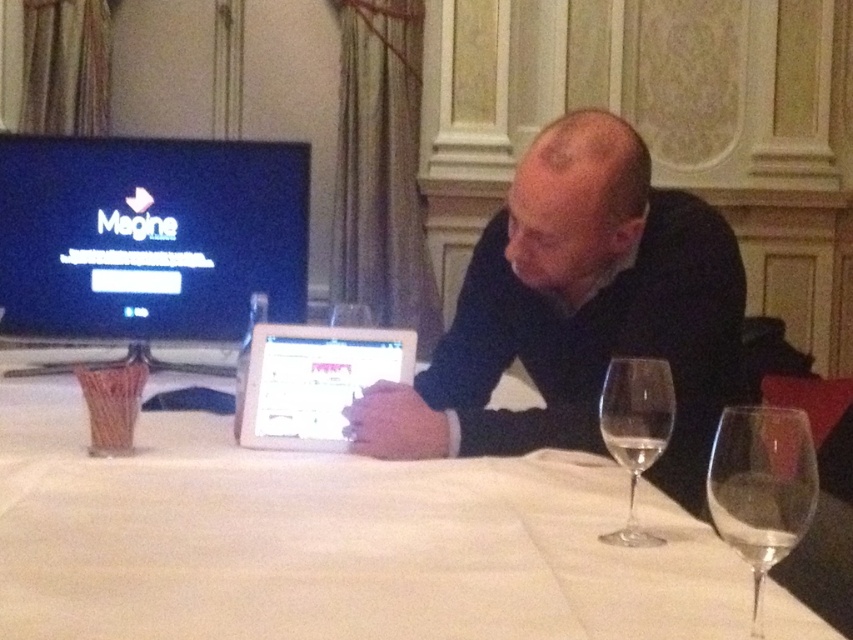
Can you confirm if white cloth at center is wider than silver metallic tablet at center?

Yes.

From the picture: Between white cloth at center and silver metallic tablet at center, which one has less height?

With less height is white cloth at center.

This screenshot has height=640, width=853. In order to click on white cloth at center in this screenshot , I will do `click(331, 540)`.

Does dark blue shirt at center have a greater height compared to clear glass at lower center?

Yes, dark blue shirt at center is taller than clear glass at lower center.

Which is behind, point (717, 419) or point (646, 435)?

The point (717, 419) is more distant.

At what (x,y) coordinates should I click in order to perform the action: click on dark blue shirt at center. Please return your answer as a coordinate pair (x, y). The height and width of the screenshot is (640, 853). Looking at the image, I should click on (577, 312).

Does clear glass wine glass at center have a lesser height compared to clear glass wine glass at right?

Yes, clear glass wine glass at center is shorter than clear glass wine glass at right.

Which is below, clear glass wine glass at center or clear glass wine glass at right?

clear glass wine glass at center is below.

Locate an element on the screen. clear glass wine glass at center is located at coordinates (761, 486).